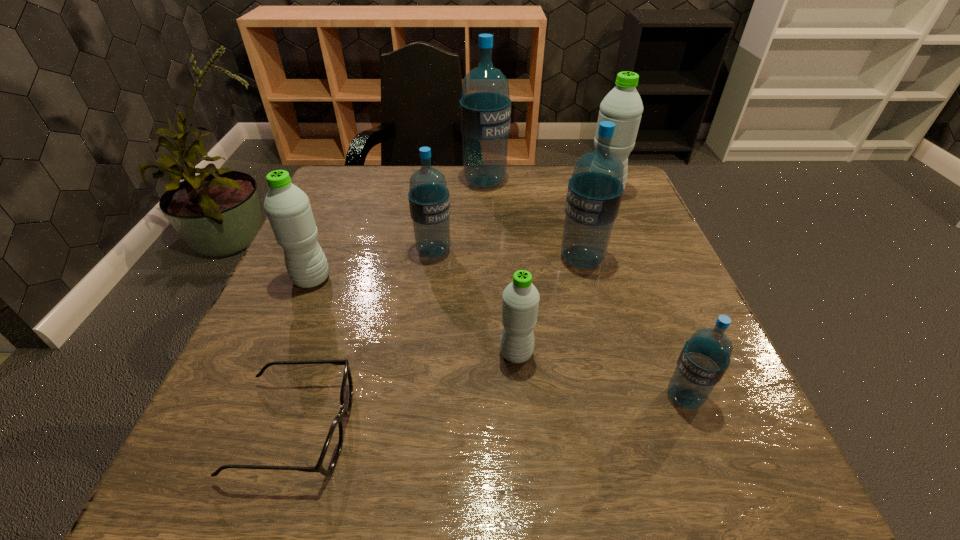
Where is `the farthest blue water bottle`? the farthest blue water bottle is located at coordinates (485, 107).

Find the location of `the second blue water bottle from left to right`. the second blue water bottle from left to right is located at coordinates (485, 107).

Identify the location of the farthest green water bottle. (623, 106).

The image size is (960, 540). Identify the location of the rightmost green water bottle. (623, 106).

Find the location of `the third water bottle from right to left`. the third water bottle from right to left is located at coordinates (595, 190).

Find the location of a particular element. The width and height of the screenshot is (960, 540). the third object from right to left is located at coordinates (595, 190).

The height and width of the screenshot is (540, 960). Find the location of `the second biggest green water bottle`. the second biggest green water bottle is located at coordinates (287, 207).

Where is `the second nearest green water bottle`? The height and width of the screenshot is (540, 960). the second nearest green water bottle is located at coordinates (287, 207).

Where is `the third object from left to right`? This screenshot has height=540, width=960. the third object from left to right is located at coordinates (429, 199).

Identify the location of the leftmost blue water bottle. (429, 199).